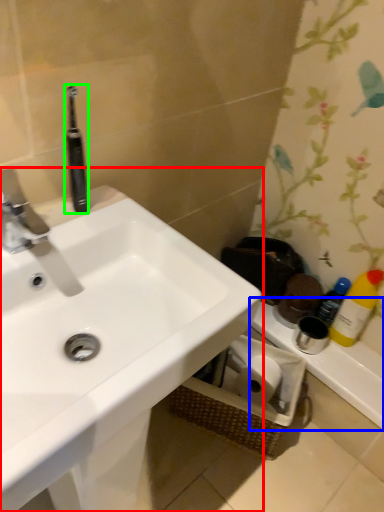
Question: Which object is the closest to the sink (highlighted by a red box)? Choose among these: counter top (highlighted by a blue box) or toothbrush (highlighted by a green box).

Choices:
 (A) counter top
 (B) toothbrush

Answer: (B)